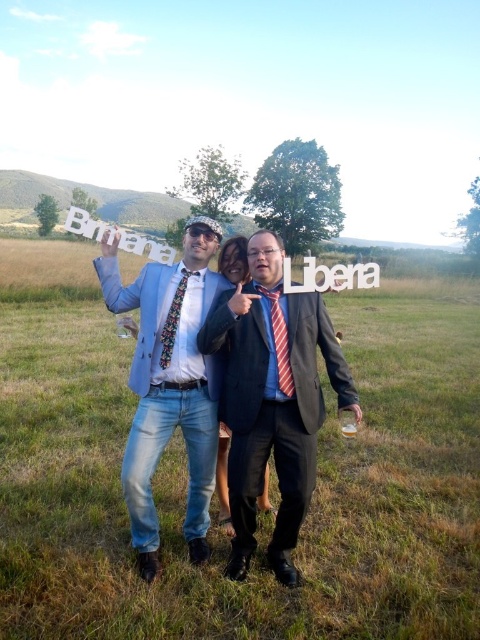
Does point (132, 467) come in front of point (241, 276)?

Yes, it is in front of point (241, 276).

Image resolution: width=480 pixels, height=640 pixels. I want to click on light blue denim jeans at center, so click(168, 381).

Who is more distant from viewer, (206, 225) or (226, 257)?

Point (226, 257)

Where is `light blue denim jeans at center`? Image resolution: width=480 pixels, height=640 pixels. light blue denim jeans at center is located at coordinates (168, 381).

Locate an element on the screen. The image size is (480, 640). matte black suit at center is located at coordinates (273, 397).

Locate an element on the screen. matte black suit at center is located at coordinates (273, 397).

What are the coordinates of `matte black suit at center` in the screenshot? It's located at [x=273, y=397].

From the picture: Is matte black suit at center shorter than matte blue dress at center?

Incorrect, matte black suit at center's height does not fall short of matte blue dress at center's.

Locate an element on the screen. matte black suit at center is located at coordinates (273, 397).